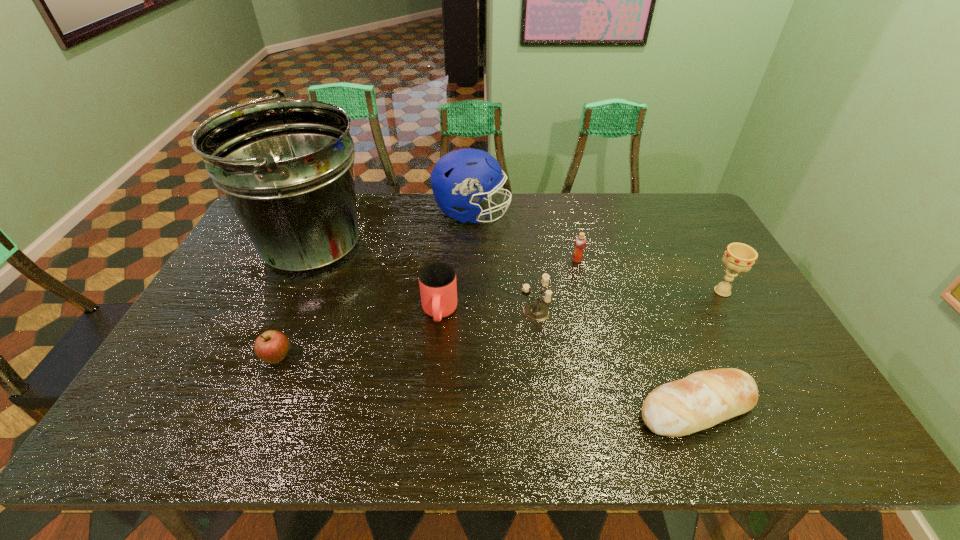
Image resolution: width=960 pixels, height=540 pixels. Identify the location of free location at the near left corner of the desktop. (132, 448).

Where is `vacant point located between the candle holder and the bread`? The height and width of the screenshot is (540, 960). vacant point located between the candle holder and the bread is located at coordinates (616, 360).

Where is `vacant area that lies between the candle holder and the cup`? This screenshot has height=540, width=960. vacant area that lies between the candle holder and the cup is located at coordinates (487, 312).

The width and height of the screenshot is (960, 540). I want to click on unoccupied area between the sixth shortest object and the second nearest object, so click(x=500, y=325).

At what (x,y) coordinates should I click in order to perform the action: click on free space that is in between the seventh shortest object and the nearest object. Please return your answer as a coordinate pair (x, y). Looking at the image, I should click on coord(585,310).

Where is `free space between the chalice and the tallest object`? Image resolution: width=960 pixels, height=540 pixels. free space between the chalice and the tallest object is located at coordinates (x=517, y=271).

In order to click on free space between the bread and the cup in this screenshot , I will do `click(568, 360)`.

Find the location of a particular element. The image size is (960, 540). free spot between the cup and the rightmost object is located at coordinates (581, 302).

Locate an element on the screen. This screenshot has width=960, height=540. free space between the football helmet and the cup is located at coordinates (456, 263).

Where is `free point between the candle holder and the sixth shortest object`? Image resolution: width=960 pixels, height=540 pixels. free point between the candle holder and the sixth shortest object is located at coordinates (629, 301).